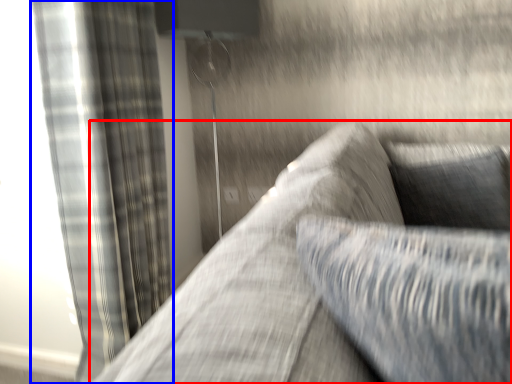
Question: Which of the following is the farthest to the observer, studio couch (highlighted by a red box) or curtain (highlighted by a blue box)?

Choices:
 (A) studio couch
 (B) curtain

Answer: (B)